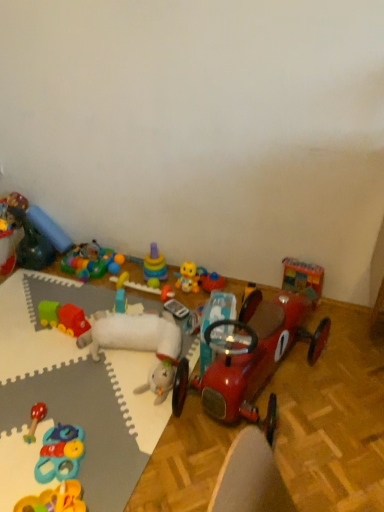
You are a GUI agent. You are given a task and a screenshot of the screen. Output one action in this format:
    pyautogui.click(x=<x>, y=<y>)
    Task: Click on the free point above translucent plastic toy at center, the eighth toy in the right-to-left sequence (from a real-world perspective)
    
    Given the screenshot: What is the action you would take?
    pyautogui.click(x=88, y=253)